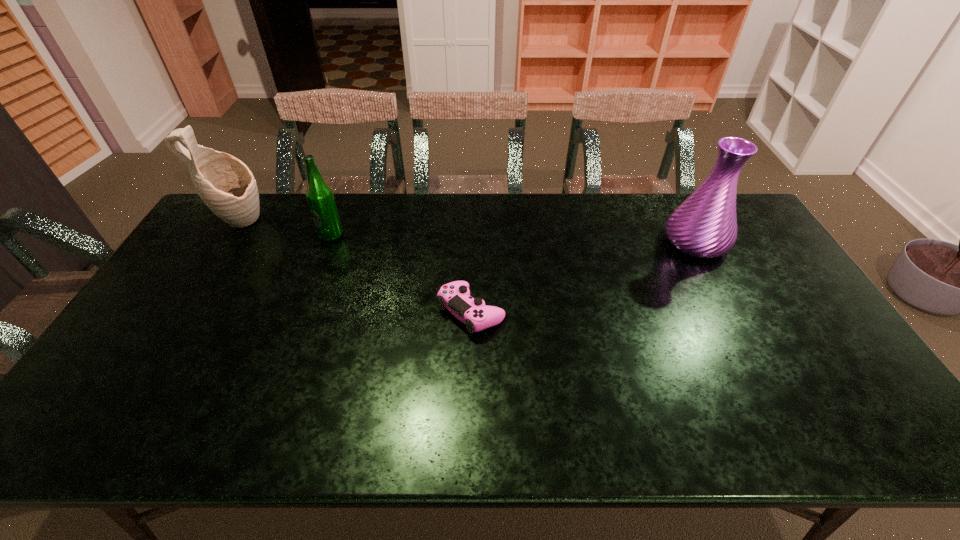
Identify the location of free region at the right edge. (824, 348).

Image resolution: width=960 pixels, height=540 pixels. What are the coordinates of `blank area at the near right corner` in the screenshot? It's located at (880, 448).

What are the coordinates of `vacant region between the second shortest object and the third object from left to right` in the screenshot? It's located at (401, 274).

Find the location of a particular element. The image size is (960, 540). vacant space that's between the second object from right to left and the second shortest object is located at coordinates pyautogui.click(x=401, y=274).

Image resolution: width=960 pixels, height=540 pixels. Find the location of `empty location between the control and the pitcher`. empty location between the control and the pitcher is located at coordinates (355, 267).

Image resolution: width=960 pixels, height=540 pixels. I want to click on free space between the second shortest object and the vase, so click(514, 239).

In order to click on unoccupied position between the leftmost object and the rightmost object in this screenshot , I will do `click(468, 232)`.

This screenshot has height=540, width=960. In order to click on free space between the nearest object and the third object from right to left in this screenshot , I will do `click(401, 274)`.

The height and width of the screenshot is (540, 960). Find the location of `vacant area between the vase and the pitcher`. vacant area between the vase and the pitcher is located at coordinates (468, 232).

The image size is (960, 540). What are the coordinates of `vacant space in between the nearest object and the vase` in the screenshot? It's located at (584, 276).